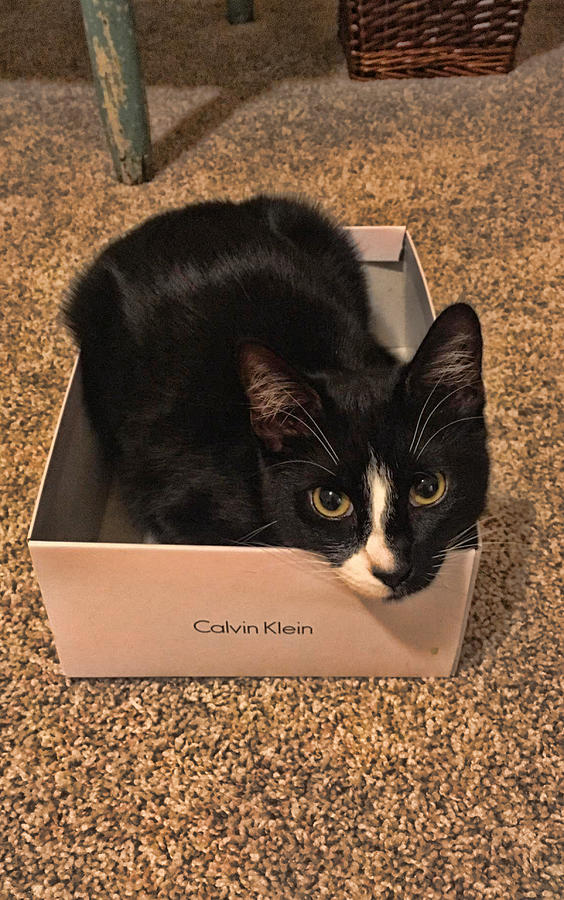
Where is `carpet below box`? The width and height of the screenshot is (564, 900). carpet below box is located at coordinates (215, 793).